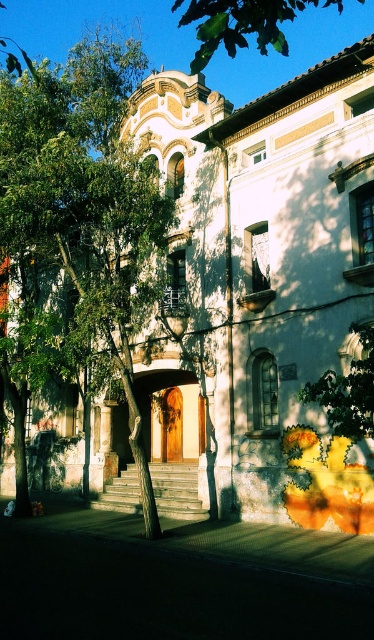
Between green leafy tree at center and green leafy tree at upper center, which one appears on the right side from the viewer's perspective?

green leafy tree at upper center is more to the right.

Is point (16, 80) farther from camera compared to point (198, 35)?

Yes.

The height and width of the screenshot is (640, 374). I want to click on green leafy tree at center, so click(x=78, y=234).